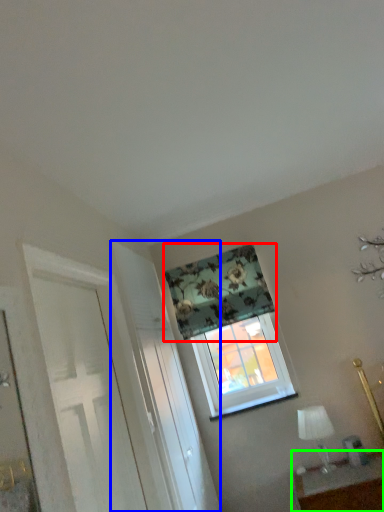
Question: Estimate the real-world distances between objects in this image. Which object is farther from curtain (highlighted by a red box), screen door (highlighted by a blue box) or table (highlighted by a green box)?

Choices:
 (A) screen door
 (B) table

Answer: (B)